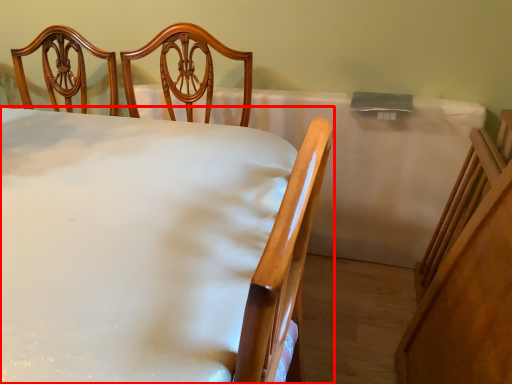
Question: From the image's perspective, where is furniture (annotated by the red box) located relative to tablecloth?

Choices:
 (A) above
 (B) below

Answer: (B)